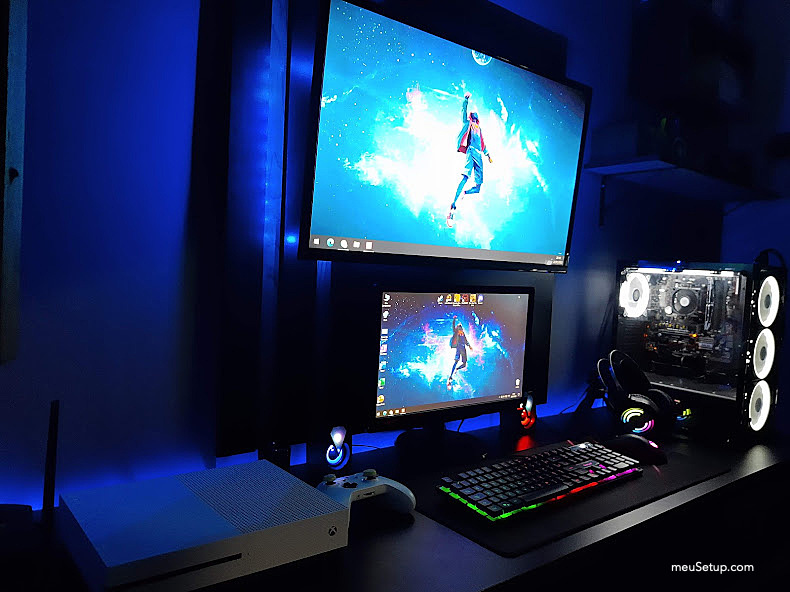
The width and height of the screenshot is (790, 592). I want to click on desk, so click(429, 558).